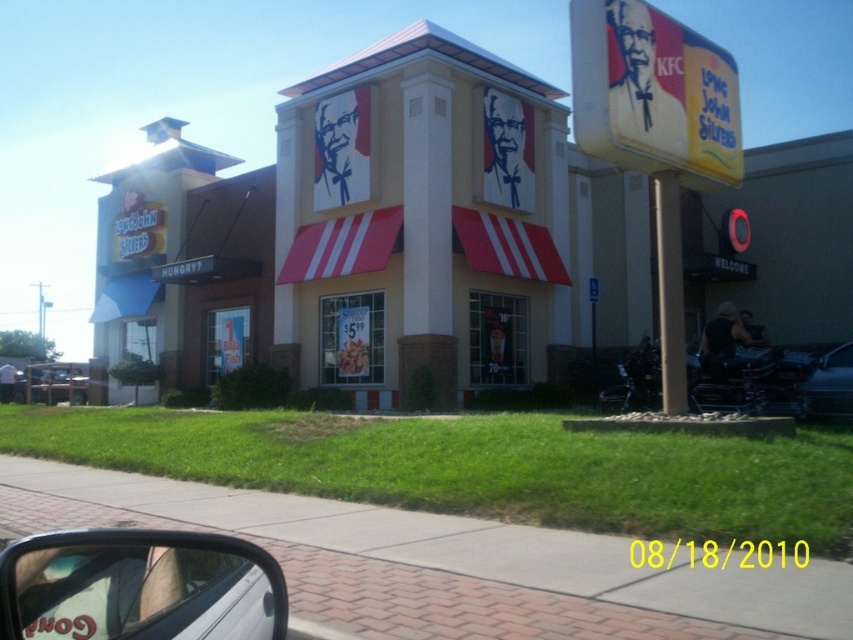
Does matte black car window at lower left come in front of black matte car at right?

Yes.

Can you confirm if matte black car window at lower left is positioned to the left of black matte car at right?

Yes, matte black car window at lower left is to the left of black matte car at right.

This screenshot has height=640, width=853. I want to click on matte black car window at lower left, so click(137, 593).

Locate an element on the screen. The image size is (853, 640). matte black car window at lower left is located at coordinates (137, 593).

Locate an element on the screen. This screenshot has height=640, width=853. yellow paper date at center is located at coordinates (706, 554).

The width and height of the screenshot is (853, 640). What do you see at coordinates (706, 554) in the screenshot? I see `yellow paper date at center` at bounding box center [706, 554].

Where is `yellow paper date at center`? The width and height of the screenshot is (853, 640). yellow paper date at center is located at coordinates (706, 554).

Is black matte car at right further to camera compared to metallic silver truck at lower left?

No.

Is black matte car at right taller than metallic silver truck at lower left?

No, black matte car at right is not taller than metallic silver truck at lower left.

Who is more forward, (834, 412) or (39, 378)?

Point (834, 412) is more forward.

Locate an element on the screen. The image size is (853, 640). black matte car at right is located at coordinates (830, 385).